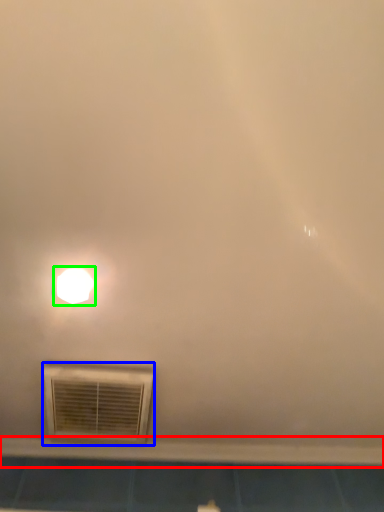
Question: Considering the real-world distances, which object is closest to window sill (highlighted by a red box)? air conditioning (highlighted by a blue box) or lamp (highlighted by a green box).

Choices:
 (A) air conditioning
 (B) lamp

Answer: (A)